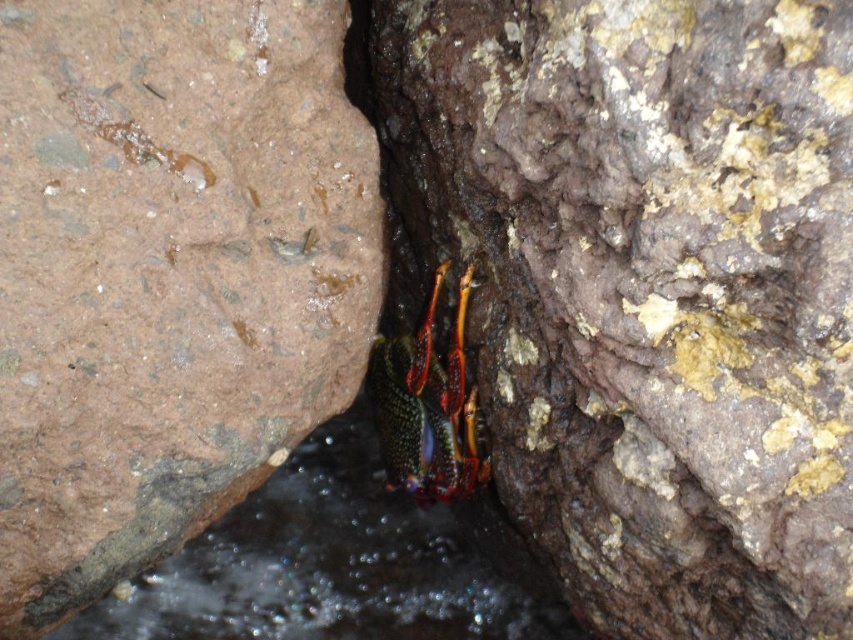
Who is more distant from viewer, [20,67] or [299,516]?

Point [299,516]

Who is higher up, brown rough rock at left or clear water at center?

brown rough rock at left

Is point (16, 337) positioned before point (367, 468)?

Yes, it is in front of point (367, 468).

Identify the location of brown rough rock at left. This screenshot has height=640, width=853. (167, 273).

Can you confirm if brown rough rock at left is wider than shiny metallic hermit crab at center?

Yes.

Between brown rough rock at left and shiny metallic hermit crab at center, which one has less height?

shiny metallic hermit crab at center

Which is behind, point (50, 486) or point (469, 468)?

The point (469, 468) is more distant.

At what (x,y) coordinates should I click in order to perform the action: click on brown rough rock at left. Please return your answer as a coordinate pair (x, y). The image size is (853, 640). Looking at the image, I should click on (167, 273).

Which is below, clear water at center or shiny metallic hermit crab at center?

clear water at center

Does clear water at center have a greater width compared to shiny metallic hermit crab at center?

Correct, the width of clear water at center exceeds that of shiny metallic hermit crab at center.

Does point (341, 541) come in front of point (453, 385)?

No, (341, 541) is behind (453, 385).

Find the location of a particular element. clear water at center is located at coordinates (338, 563).